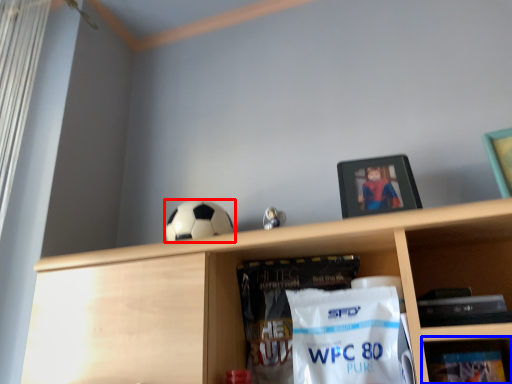
Question: Among these objects, which one is farthest to the camera, football (highlighted by a red box) or shelf (highlighted by a blue box)?

Choices:
 (A) football
 (B) shelf

Answer: (A)